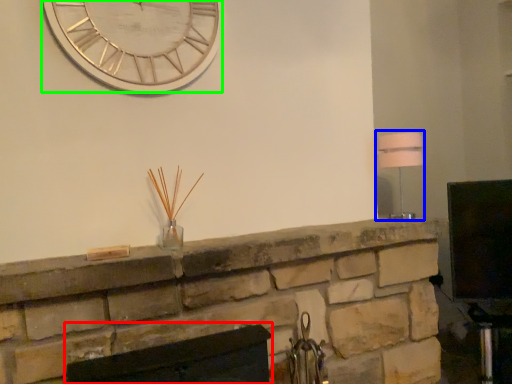
Question: Which object is positioned closest to fireplace (highlighted by a red box)? Select from lamp (highlighted by a blue box) and wall clock (highlighted by a green box).

Choices:
 (A) lamp
 (B) wall clock

Answer: (B)